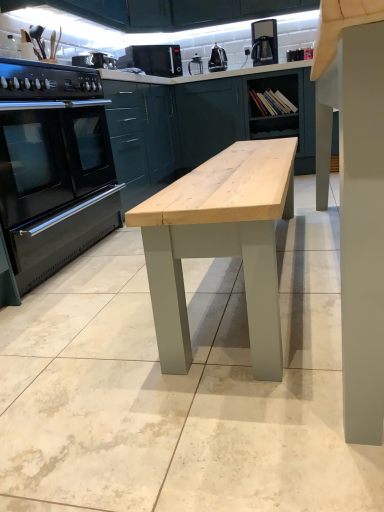
Question: From the image's perspective, is black stainless steel oven at left over black matte microwave at upper center?

Choices:
 (A) yes
 (B) no

Answer: (B)

Question: Is black matte microwave at upper center a part of black stainless steel oven at left?

Choices:
 (A) no
 (B) yes

Answer: (A)

Question: From the image's perspective, is black stainless steel oven at left under black matte microwave at upper center?

Choices:
 (A) yes
 (B) no

Answer: (A)

Question: Is black stainless steel oven at left oriented towards black matte microwave at upper center?

Choices:
 (A) no
 (B) yes

Answer: (A)

Question: Is black stainless steel oven at left smaller than black matte microwave at upper center?

Choices:
 (A) no
 (B) yes

Answer: (A)

Question: Based on their positions, is matte green cabinet at upper center located to the left or right of metallic silver toaster at upper center, the 1th appliance positioned from the front?

Choices:
 (A) right
 (B) left

Answer: (A)

Question: In the image, is matte green cabinet at upper center positioned in front of or behind metallic silver toaster at upper center, which appears as the second appliance when viewed from the top?

Choices:
 (A) behind
 (B) front

Answer: (A)

Question: Considering the positions of point 183,136 and point 79,57, is point 183,136 closer or farther from the camera than point 79,57?

Choices:
 (A) closer
 (B) farther

Answer: (B)

Question: Would you say matte green cabinet at upper center is inside or outside metallic silver toaster at upper center, which appears as the second appliance when viewed from the top?

Choices:
 (A) inside
 (B) outside

Answer: (B)

Question: Is black matte gas stove at left situated inside metallic silver kettle at upper center, which ranks as the 1th appliance in top-to-bottom order, or outside?

Choices:
 (A) inside
 (B) outside

Answer: (B)

Question: In the image, is black matte gas stove at left positioned in front of or behind metallic silver kettle at upper center, which ranks as the 1th appliance in top-to-bottom order?

Choices:
 (A) front
 (B) behind

Answer: (A)

Question: Considering the positions of black matte gas stove at left and metallic silver kettle at upper center, placed as the 2th appliance when sorted from bottom to top, in the image, is black matte gas stove at left taller or shorter than metallic silver kettle at upper center, placed as the 2th appliance when sorted from bottom to top,?

Choices:
 (A) short
 (B) tall

Answer: (A)

Question: Visually, is black matte gas stove at left positioned to the left or to the right of metallic silver kettle at upper center, which ranks as the 1th appliance in top-to-bottom order?

Choices:
 (A) right
 (B) left

Answer: (B)

Question: Is metallic silver toaster at upper center, which is counted as the first appliance, starting from the bottom, bigger or smaller than matte green cabinet at upper center?

Choices:
 (A) big
 (B) small

Answer: (B)

Question: Is metallic silver toaster at upper center, which is counted as the first appliance, starting from the bottom, taller or shorter than matte green cabinet at upper center?

Choices:
 (A) tall
 (B) short

Answer: (B)